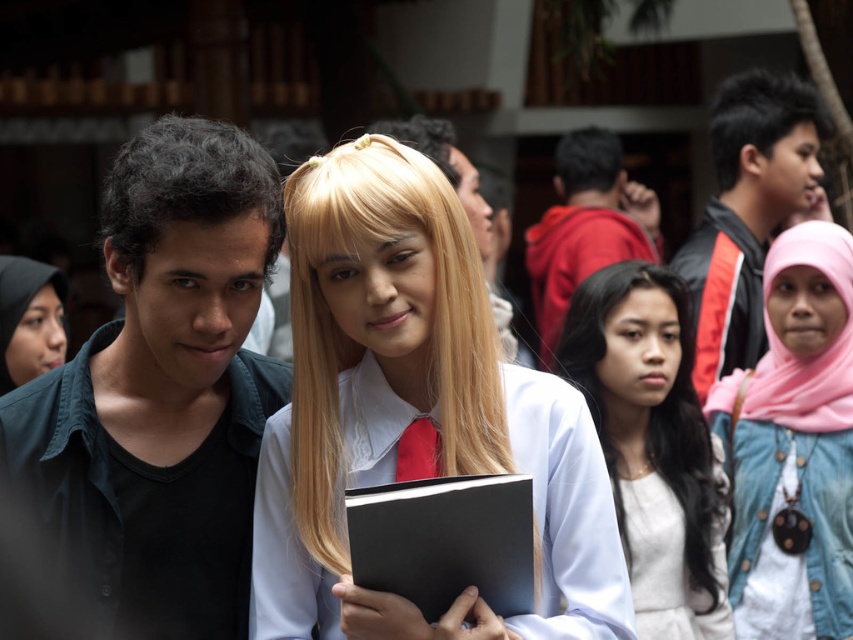
You are a photographer trying to capture a candid shot of the dark brown hair at upper center without including the pink fabric hijab at upper right in the frame. Based on their relative positions and heights, is this possible?

The pink fabric hijab at upper right has a greater height compared to dark brown hair at upper center. Therefore, it might be challenging to capture the dark brown hair at upper center without including the pink fabric hijab at upper right in the frame due to its taller position.

In the scene shown: You are a photographer standing at the camera position. You want to capture a closeup shot of the pink fabric hijab at upper right without moving the camera. Is it possible to do so with a standard zoom lens that has a maximum zoom of 200mm?

The pink fabric hijab at upper right is 3.41 meters away from camera. With a standard zoom lens of 200mm, it is possible to capture a closeup shot without moving the camera, as the distance is within the effective range of the lens.